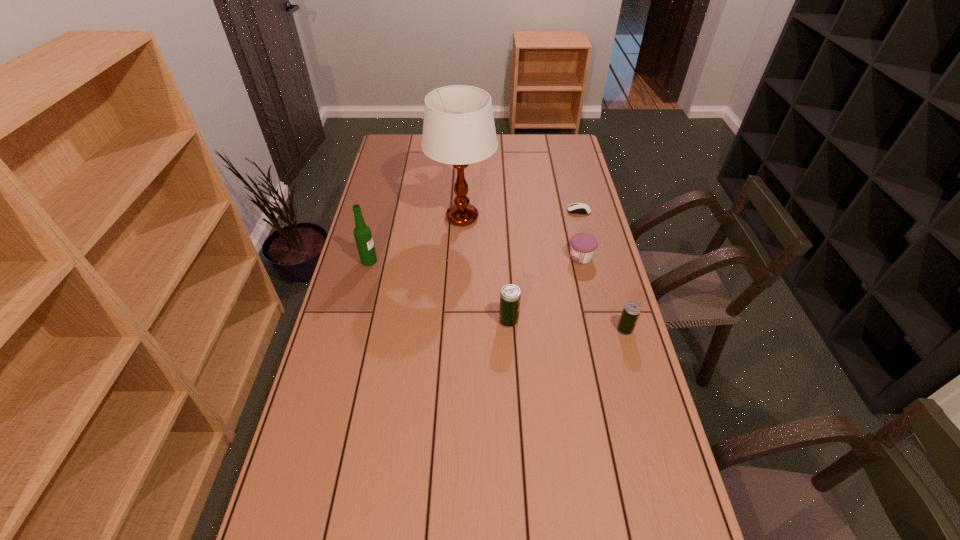
At what (x,y) coordinates should I click in order to perform the action: click on free point between the beer bottle and the jam. Please return your answer as a coordinate pair (x, y). The height and width of the screenshot is (540, 960). Looking at the image, I should click on (475, 259).

Identify the location of vacant point located between the shortest object and the taller beer can. (543, 266).

The width and height of the screenshot is (960, 540). In order to click on free space between the mouse and the tallest object in this screenshot , I will do `click(520, 214)`.

Find the location of a particular element. vacant space in between the second tallest object and the table lamp is located at coordinates (416, 239).

Where is `unoccupied area between the shortest object and the left beer can`? unoccupied area between the shortest object and the left beer can is located at coordinates (543, 266).

The width and height of the screenshot is (960, 540). Identify the location of object identified as the fourth closest to the taller beer can. point(362,233).

Identify which object is the fifth nearest to the left beer can. Please provide its 2D coordinates. Your answer should be formatted as a tuple, i.e. [(x, y)], where the tuple contains the x and y coordinates of a point satisfying the conditions above.

[(576, 208)]

Locate an element on the screen. The height and width of the screenshot is (540, 960). vacant area in the image that satisfies the following two spatial constraints: 1. on the front label of the right beer can; 2. on the left side of the fifth tallest object is located at coordinates (597, 329).

What are the coordinates of `free space that satisfies the following two spatial constraints: 1. on the front side of the mouse; 2. on the label of the beer bottle` in the screenshot? It's located at coord(591,261).

This screenshot has width=960, height=540. Find the location of `vacant region that satisfies the following two spatial constraints: 1. on the front label of the fourth tallest object; 2. on the right side of the jam`. vacant region that satisfies the following two spatial constraints: 1. on the front label of the fourth tallest object; 2. on the right side of the jam is located at coordinates (597, 329).